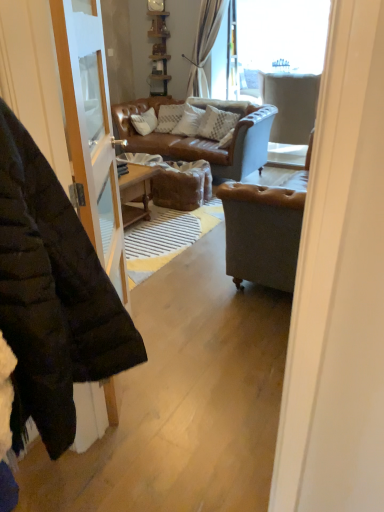
Describe the element at coordinates (52, 296) in the screenshot. I see `black puffer jacket at left` at that location.

The width and height of the screenshot is (384, 512). What do you see at coordinates (291, 104) in the screenshot? I see `light gray fabric armchair at upper right` at bounding box center [291, 104].

Where is `textured beige pillow at center`? The height and width of the screenshot is (512, 384). textured beige pillow at center is located at coordinates [216, 123].

What do you see at coordinates (216, 123) in the screenshot?
I see `textured beige pillow at center` at bounding box center [216, 123].

Where is `black puffer jacket at left`? black puffer jacket at left is located at coordinates (52, 296).

From the image's perspective, which one is positioned lower, light gray fabric armchair at upper right or black puffer jacket at left?

black puffer jacket at left is shown below in the image.

In the image, is light gray fabric armchair at upper right positioned in front of or behind black puffer jacket at left?

light gray fabric armchair at upper right is positioned farther from the viewer than black puffer jacket at left.

Is light gray fabric armchair at upper right facing away from black puffer jacket at left?

Yes, black puffer jacket at left is at the back of light gray fabric armchair at upper right.

Does transparent glass window at upper center appear on the left side of textured beige pillow at center?

No, transparent glass window at upper center is not to the left of textured beige pillow at center.

Who is taller, transparent glass window at upper center or textured beige pillow at center?

With more height is transparent glass window at upper center.

Locate an element on the screen. This screenshot has height=512, width=384. window that is behind the textured beige pillow at center is located at coordinates (275, 40).

Which is more to the right, black puffer jacket at left or transparent glass window at upper center?

Positioned to the right is transparent glass window at upper center.

Considering the positions of points (67, 279) and (256, 4), is point (67, 279) closer to camera compared to point (256, 4)?

That is True.

Who is shorter, black puffer jacket at left or transparent glass window at upper center?

transparent glass window at upper center is shorter.

The width and height of the screenshot is (384, 512). I want to click on window above the black puffer jacket at left (from the image's perspective), so click(x=275, y=40).

Is textured beige pillow at center facing towards transparent glass window at upper center?

No, textured beige pillow at center is not turned towards transparent glass window at upper center.

Which object is thinner, textured beige pillow at center or transparent glass window at upper center?

Thinner between the two is transparent glass window at upper center.

Does point (223, 125) lie in front of point (267, 44)?

Yes, point (223, 125) is in front of point (267, 44).

Image resolution: width=384 pixels, height=512 pixels. Find the location of `armchair above the black puffer jacket at left (from the image's perspective)`. armchair above the black puffer jacket at left (from the image's perspective) is located at coordinates (291, 104).

From the image's perspective, between black puffer jacket at left and light gray fabric armchair at upper right, who is located below?

black puffer jacket at left.

Can you confirm if black puffer jacket at left is thinner than light gray fabric armchair at upper right?

Yes, black puffer jacket at left is thinner than light gray fabric armchair at upper right.

Is black puffer jacket at left aimed at light gray fabric armchair at upper right?

No, black puffer jacket at left is not facing towards light gray fabric armchair at upper right.

How far apart are light gray fabric armchair at upper right and transparent glass window at upper center?

They are 19.00 inches apart.

From the image's perspective, which is above, light gray fabric armchair at upper right or transparent glass window at upper center?

transparent glass window at upper center, from the image's perspective.

Does light gray fabric armchair at upper right lie behind transparent glass window at upper center?

No, it is not.

From a real-world perspective, is transparent glass window at upper center above or below light gray fabric armchair at upper right?

From a real-world perspective, transparent glass window at upper center is physically above light gray fabric armchair at upper right.

Is transparent glass window at upper center located outside light gray fabric armchair at upper right?

Indeed, transparent glass window at upper center is completely outside light gray fabric armchair at upper right.

Is point (265, 23) less distant than point (310, 91)?

No, it is behind (310, 91).

I want to click on jacket above the light gray fabric armchair at upper right (from a real-world perspective), so click(52, 296).

I want to click on pillow that appears in front of the transparent glass window at upper center, so point(216,123).

When comparing their distances from transparent glass window at upper center, does light gray fabric armchair at upper right or textured beige pillow at center seem closer?

light gray fabric armchair at upper right lies closer to transparent glass window at upper center than the other object.

Based on their spatial positions, is transparent glass window at upper center or light gray fabric armchair at upper right further from textured beige pillow at center?

transparent glass window at upper center.

Looking at the image, which one is located further to black puffer jacket at left, textured beige pillow at center or light gray fabric armchair at upper right?

light gray fabric armchair at upper right is positioned further to the anchor black puffer jacket at left.

When comparing their distances from black puffer jacket at left, does light gray fabric armchair at upper right or textured beige pillow at center seem further?

light gray fabric armchair at upper right.

Which object lies nearer to the anchor point light gray fabric armchair at upper right, textured beige pillow at center or black puffer jacket at left?

textured beige pillow at center is closer to light gray fabric armchair at upper right.

From the image, which object appears to be farther from black puffer jacket at left, transparent glass window at upper center or light gray fabric armchair at upper right?

transparent glass window at upper center.

When comparing their distances from light gray fabric armchair at upper right, does black puffer jacket at left or transparent glass window at upper center seem closer?

The object closer to light gray fabric armchair at upper right is transparent glass window at upper center.

From the image, which object appears to be farther from transparent glass window at upper center, light gray fabric armchair at upper right or black puffer jacket at left?

black puffer jacket at left lies further to transparent glass window at upper center than the other object.

Image resolution: width=384 pixels, height=512 pixels. I want to click on pillow between black puffer jacket at left and light gray fabric armchair at upper right in the front-back direction, so click(216, 123).

Identify the location of pillow between black puffer jacket at left and transparent glass window at upper center in the front-back direction. Image resolution: width=384 pixels, height=512 pixels. (216, 123).

This screenshot has height=512, width=384. What are the coordinates of `armchair located between black puffer jacket at left and transparent glass window at upper center in the depth direction` in the screenshot? It's located at (291, 104).

Identify the location of armchair between textured beige pillow at center and transparent glass window at upper center in the front-back direction. This screenshot has width=384, height=512. (291, 104).